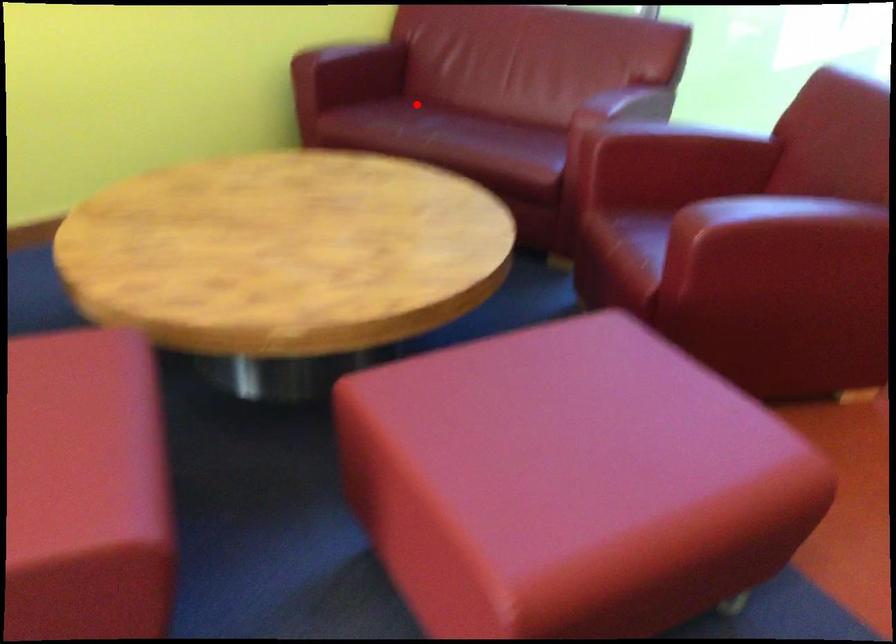
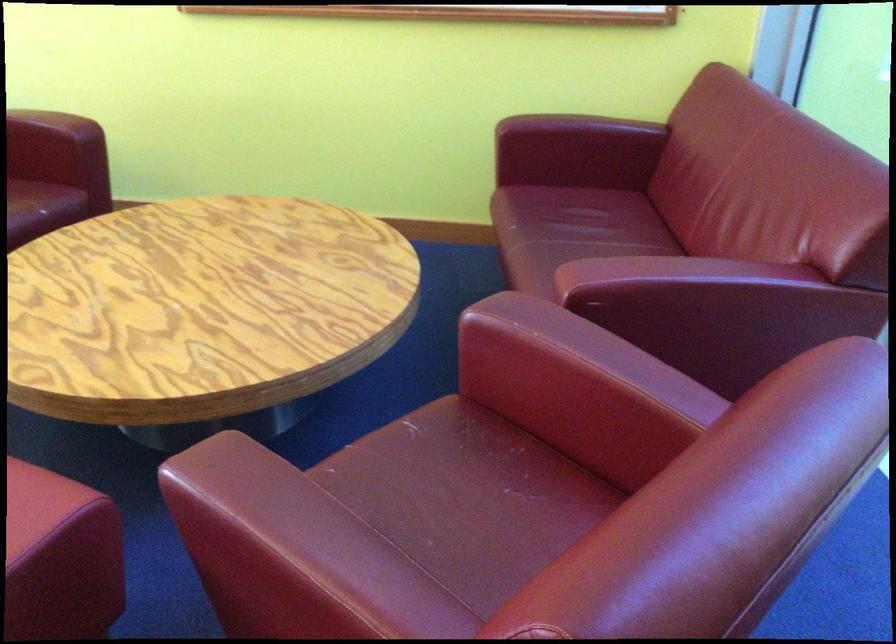
Question: I am providing you with two images of the same scene from different viewpoints. A red point is marked on the first image. Is the red point's position out of view in image 2?

Choices:
 (A) Yes
 (B) No

Answer: (B)